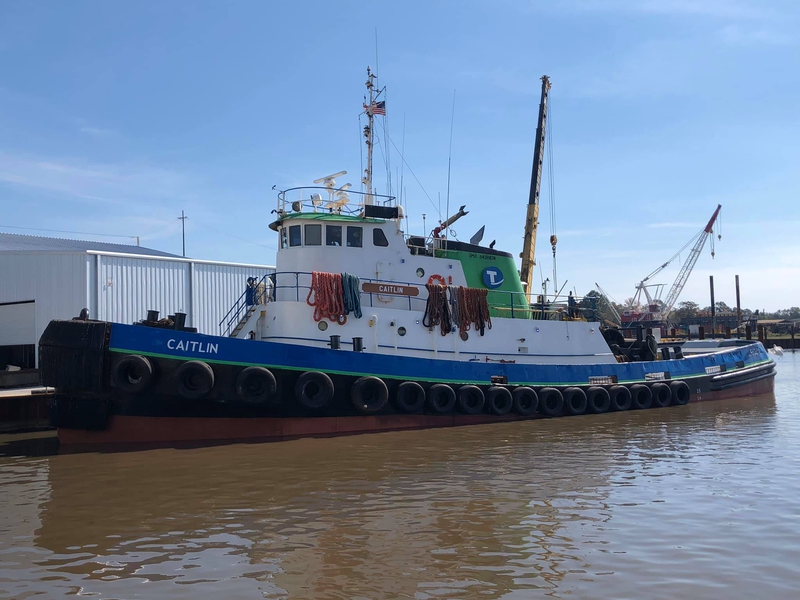
Identify the location of entrance. This screenshot has height=600, width=800. (22, 291).